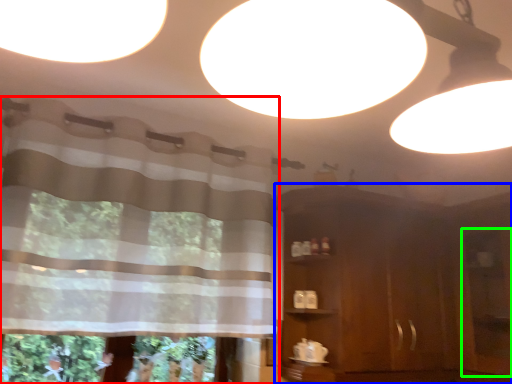
Question: Which object is positioned closest to curtain (highlighted by a red box)? Select from dresser (highlighted by a blue box) and screen door (highlighted by a green box).

Choices:
 (A) dresser
 (B) screen door

Answer: (A)